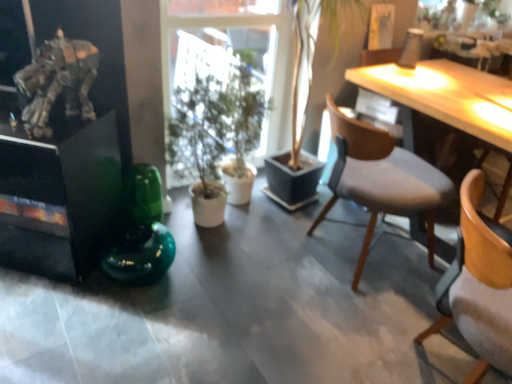
Question: Considering the relative positions of wooden chair with grey cushion at right, which ranks as the 2th chair in front-to-back order, and light wood desk at upper right in the image provided, is wooden chair with grey cushion at right, which ranks as the 2th chair in front-to-back order, to the right of light wood desk at upper right from the viewer's perspective?

Choices:
 (A) yes
 (B) no

Answer: (B)

Question: Considering the relative sizes of wooden chair with grey cushion at right, positioned as the first chair in back-to-front order, and light wood desk at upper right in the image provided, is wooden chair with grey cushion at right, positioned as the first chair in back-to-front order, thinner than light wood desk at upper right?

Choices:
 (A) yes
 (B) no

Answer: (B)

Question: From a real-world perspective, does wooden chair with grey cushion at right, which ranks as the 2th chair in front-to-back order, stand above light wood desk at upper right?

Choices:
 (A) yes
 (B) no

Answer: (B)

Question: Is wooden chair with grey cushion at right, which ranks as the 2th chair in front-to-back order, facing towards light wood desk at upper right?

Choices:
 (A) yes
 (B) no

Answer: (B)

Question: From a real-world perspective, is wooden chair with grey cushion at right, which ranks as the 2th chair in front-to-back order, located beneath light wood desk at upper right?

Choices:
 (A) yes
 (B) no

Answer: (A)

Question: From the image's perspective, would you say wooden chair with grey cushion at right, which ranks as the 2th chair in front-to-back order, is shown under light wood desk at upper right?

Choices:
 (A) no
 (B) yes

Answer: (B)

Question: Is wooden chair at right, positioned as the second chair in back-to-front order, shorter than green glass vase at center?

Choices:
 (A) no
 (B) yes

Answer: (A)

Question: Considering the relative sizes of wooden chair at right, positioned as the second chair in back-to-front order, and green glass vase at center in the image provided, is wooden chair at right, positioned as the second chair in back-to-front order, taller than green glass vase at center?

Choices:
 (A) yes
 (B) no

Answer: (A)

Question: Is wooden chair at right, positioned as the second chair in back-to-front order, to the right of green glass vase at center from the viewer's perspective?

Choices:
 (A) yes
 (B) no

Answer: (A)

Question: From a real-world perspective, is wooden chair at right, positioned as the second chair in back-to-front order, on top of green glass vase at center?

Choices:
 (A) yes
 (B) no

Answer: (A)

Question: From a real-world perspective, is wooden chair at right, positioned as the second chair in back-to-front order, positioned under green glass vase at center based on gravity?

Choices:
 (A) no
 (B) yes

Answer: (A)

Question: Does wooden chair at right, positioned as the second chair in back-to-front order, contain green glass vase at center?

Choices:
 (A) no
 (B) yes

Answer: (A)

Question: Is metallic silver robot at upper left further to the viewer compared to wooden chair with grey cushion at right, positioned as the first chair in back-to-front order?

Choices:
 (A) yes
 (B) no

Answer: (B)